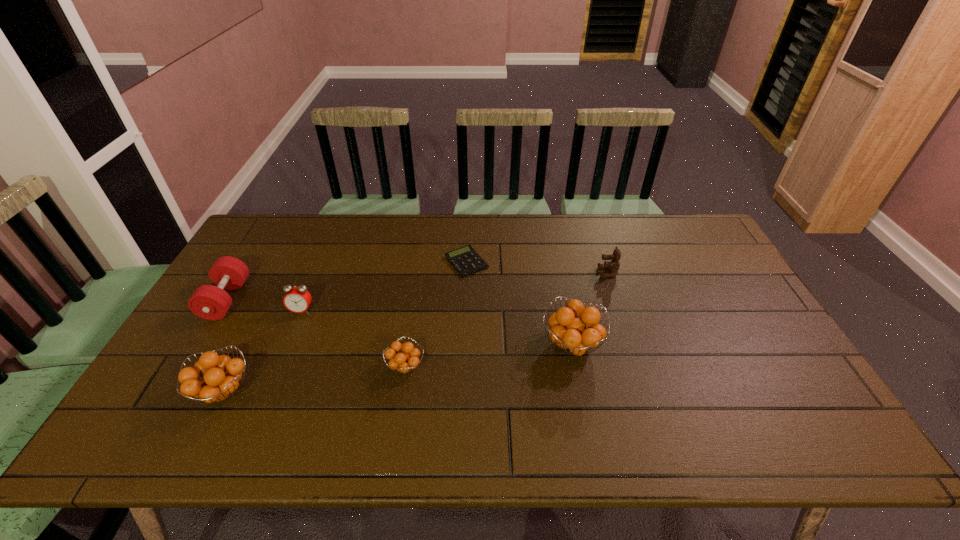
Image resolution: width=960 pixels, height=540 pixels. In order to click on the second tallest orange fruit in this screenshot , I will do [221, 374].

Identify the location of the second object from left to right. (221, 374).

Find the location of a particular element. the shortest orange fruit is located at coordinates (408, 360).

Where is `the second orange fruit from left to right`? The height and width of the screenshot is (540, 960). the second orange fruit from left to right is located at coordinates (408, 360).

Locate an element on the screen. the second object from right to left is located at coordinates (574, 336).

I want to click on the shortest object, so click(x=465, y=260).

I want to click on calculator, so click(465, 260).

Locate an element on the screen. Image resolution: width=960 pixels, height=540 pixels. the rightmost object is located at coordinates (613, 265).

Locate an element on the screen. The height and width of the screenshot is (540, 960). dumbbell is located at coordinates (209, 302).

I want to click on the third object from left to right, so click(x=297, y=299).